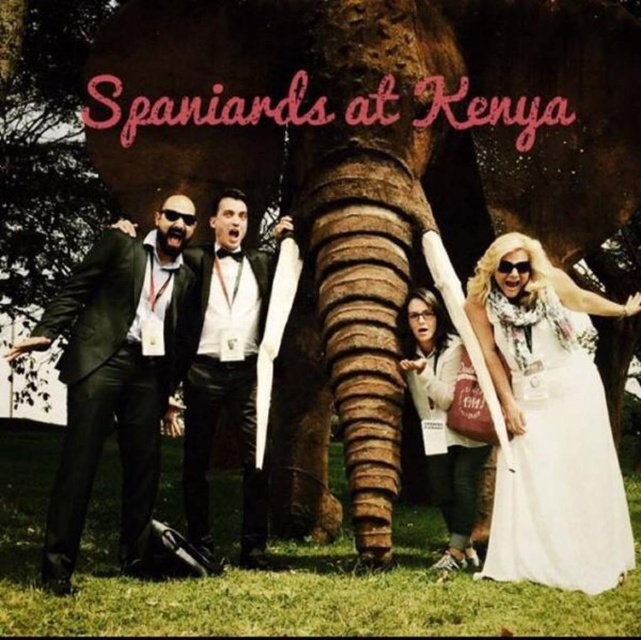
You are standing in front of the elephant statue and want to take a photo. You notice two points marked in the scene. The first point is at coordinate point (540, 483) and the second is at point (53, 518). Which point is closer to your camera?

Point (540, 483) is further to the camera than point (53, 518), so the second point is closer to the camera.

You are a photographer trying to capture the group of five individuals in front of the elephant statue. You notice a point marked at coordinates [117,392] on your camera screen. Which person in the group is located at this point?

The point at coordinates [117,392] marks the location of the black matte suit at left.

You are a photographer at the event and need to adjust the camera focus. Since the black matte suit at left and the white matte jacket at center are overlapping, which one is closer to the camera?

The black matte suit at left is in front of the white matte jacket at center, so it is closer to the camera.